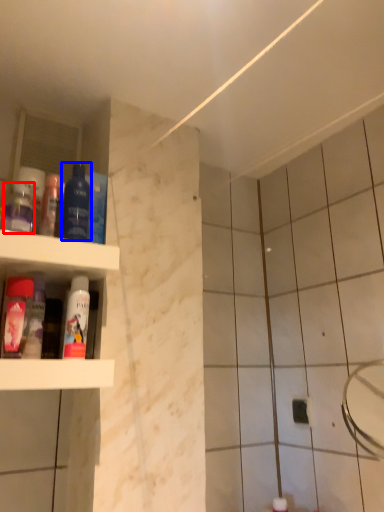
Question: Which object appears closest to the camera in this image, mouthwash (highlighted by a red box) or mouthwash (highlighted by a blue box)?

Choices:
 (A) mouthwash
 (B) mouthwash

Answer: (B)